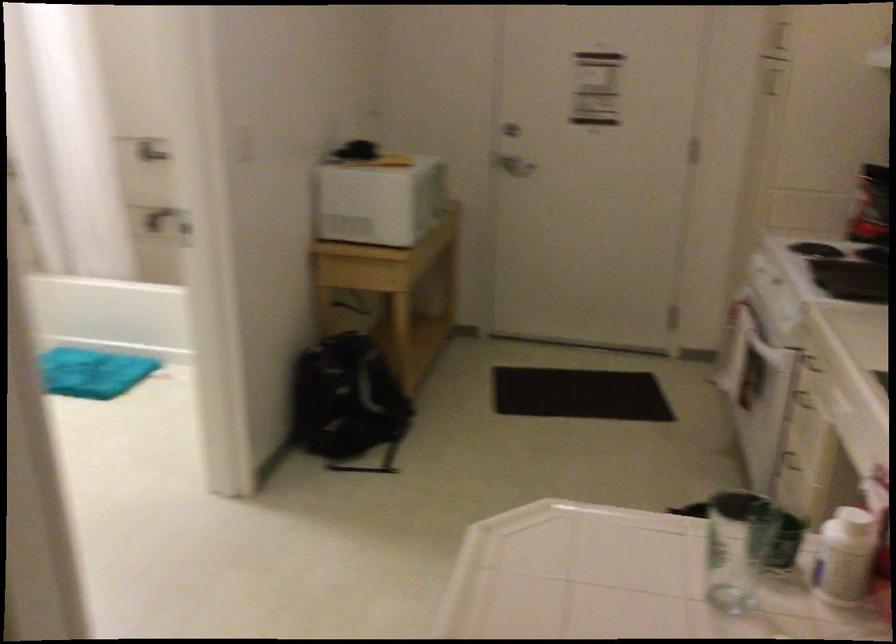
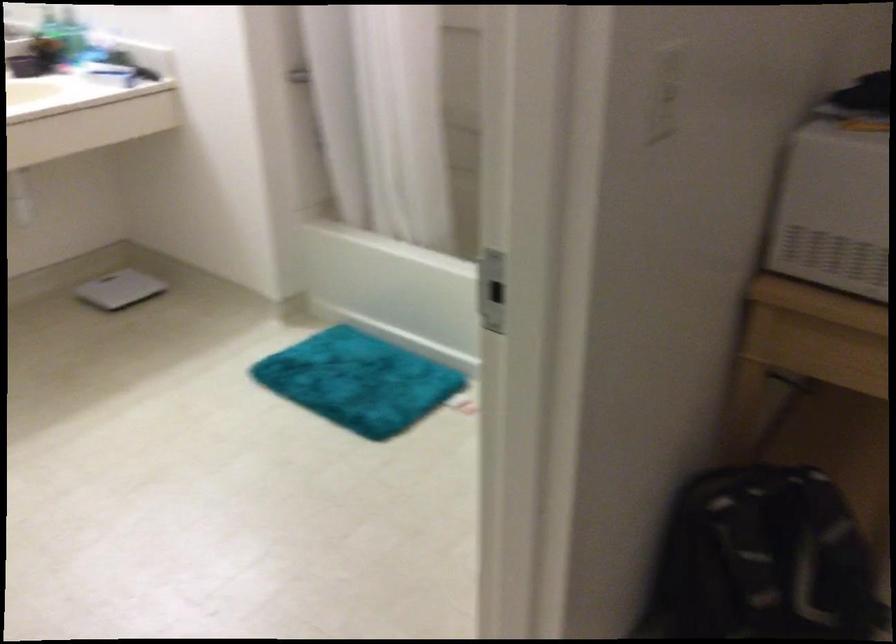
Question: The images are taken continuously from a first-person perspective. In which direction are you moving?

Choices:
 (A) Left
 (B) Right
 (C) Forward
 (D) Backward

Answer: (C)